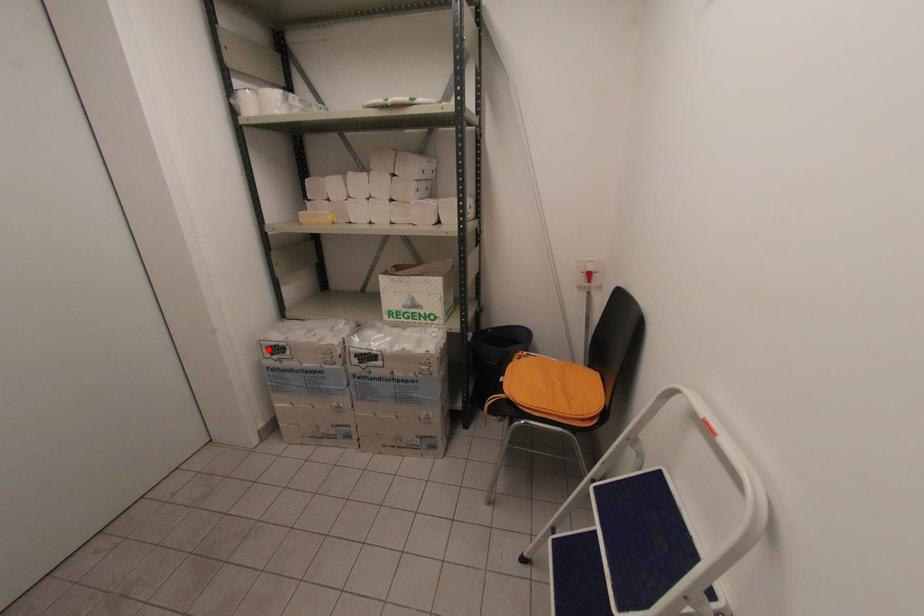
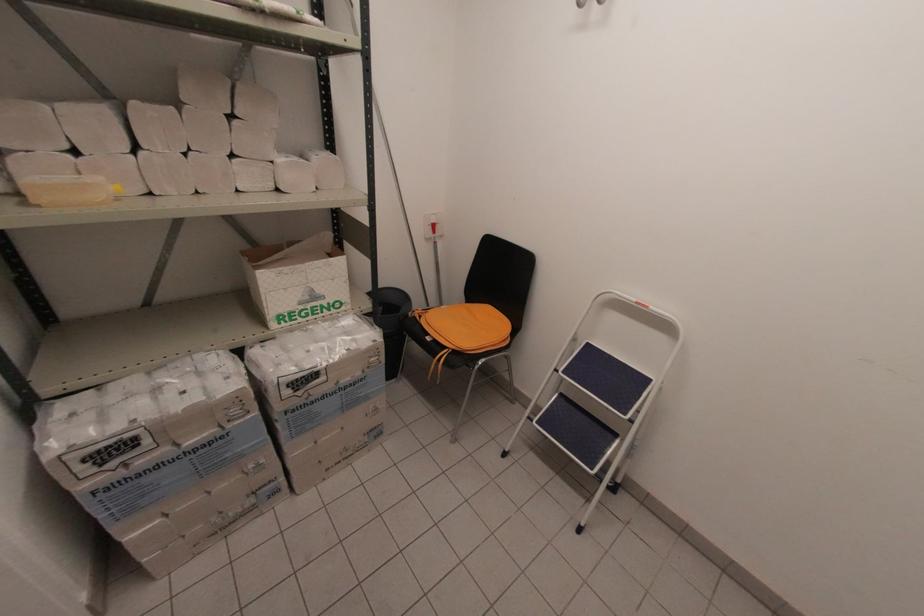
Where in the second image is the point corresponding to the highlighted location from the first image?

(84, 463)